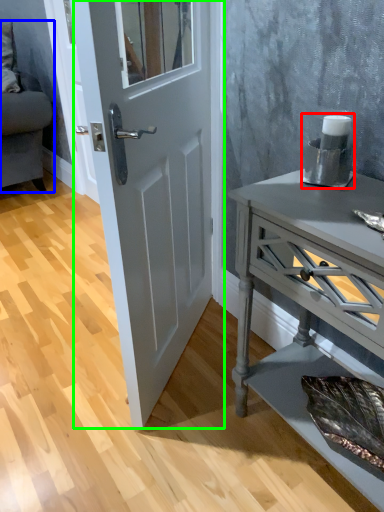
Question: Which object is the closest to the appliance (highlighted by a red box)? Choose among these: studio couch (highlighted by a blue box) or door (highlighted by a green box).

Choices:
 (A) studio couch
 (B) door

Answer: (B)